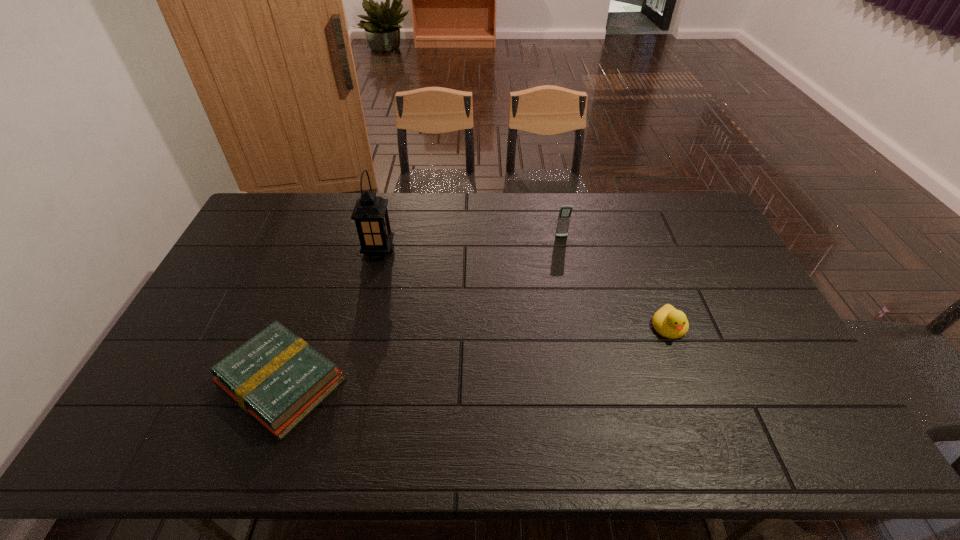
Locate an element on the screen. lantern is located at coordinates (370, 213).

Where is `the third nearest object`? The height and width of the screenshot is (540, 960). the third nearest object is located at coordinates tap(370, 213).

You are a GUI agent. You are given a task and a screenshot of the screen. Output one action in this format:
    pyautogui.click(x=<x>, y=<y>)
    Task: Click on the third shortest object
    This screenshot has width=960, height=540.
    Given the screenshot: What is the action you would take?
    pyautogui.click(x=565, y=212)

You are a GUI agent. You are given a task and a screenshot of the screen. Output one action in this format:
    pyautogui.click(x=<x>, y=<y>)
    Task: Click on the second object from right to left
    This screenshot has height=540, width=960.
    Given the screenshot: What is the action you would take?
    pyautogui.click(x=565, y=212)

The image size is (960, 540). I want to click on the rightmost object, so click(669, 322).

At what (x,y) coordinates should I click in order to perform the action: click on hardback book. Please return your answer as a coordinate pair (x, y). The image size is (960, 540). Looking at the image, I should click on (276, 377).

You are a GUI agent. You are given a task and a screenshot of the screen. Output one action in this format:
    pyautogui.click(x=<x>, y=<y>)
    Task: Click on the blank space located on the left of the tallest object
    
    Given the screenshot: What is the action you would take?
    tap(245, 251)

Where is `vacant space located on the front-facing side of the second object from right to left`? vacant space located on the front-facing side of the second object from right to left is located at coordinates (568, 269).

Locate an element on the screen. vacant space situated on the face of the duckling is located at coordinates (715, 448).

Identify the location of blank space located 0.130m on the left of the hardback book. This screenshot has height=540, width=960. (167, 382).